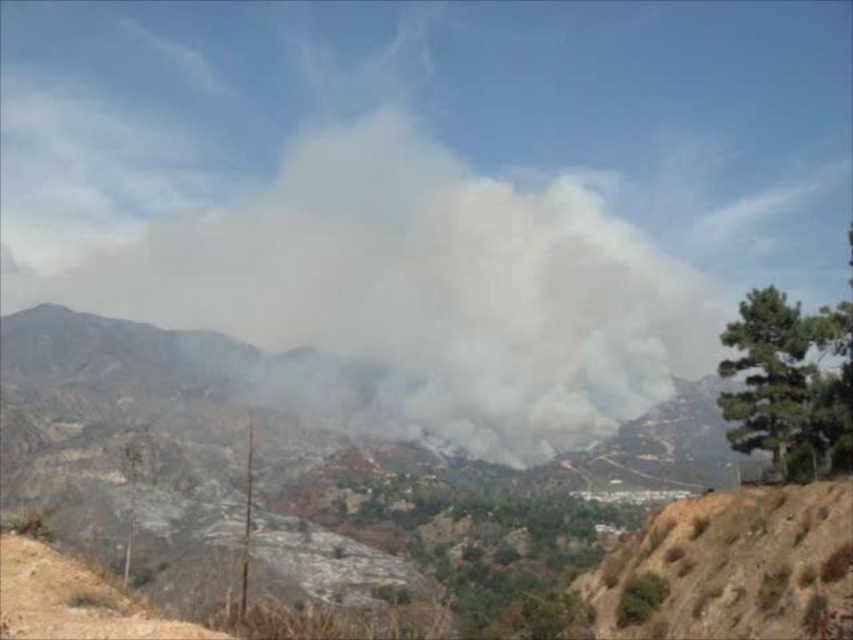
Based on the photo, does white smoke at center appear on the left side of brown dirt track at lower left?

Correct, you'll find white smoke at center to the left of brown dirt track at lower left.

Who is higher up, white smoke at center or brown dirt track at lower left?

white smoke at center is higher up.

Measure the distance between point (485, 342) and camera.

Point (485, 342) and camera are 1588.77 feet apart from each other.

At what (x,y) coordinates should I click in order to perform the action: click on white smoke at center. Please return your answer as a coordinate pair (x, y). Looking at the image, I should click on (418, 291).